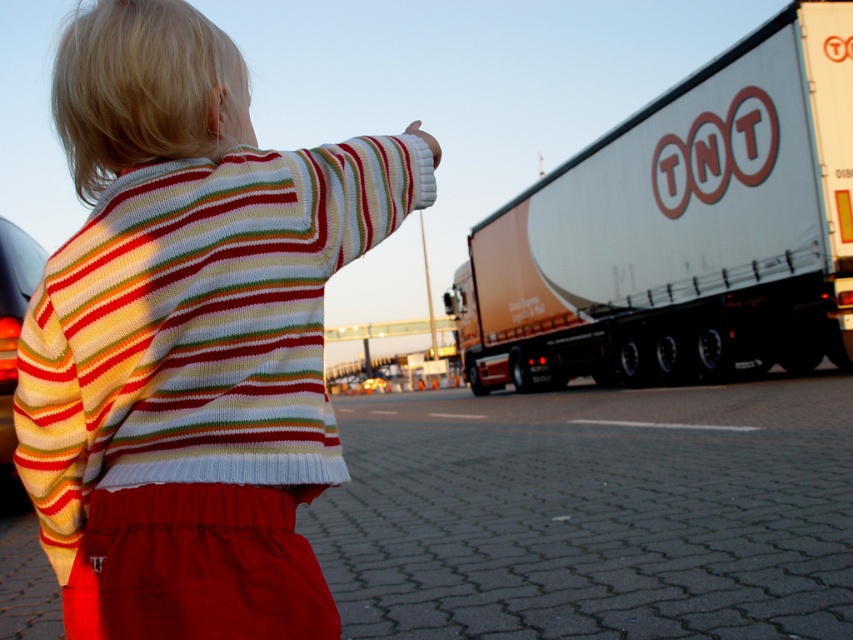
Question: Among these points, which one is farthest from the camera?

Choices:
 (A) (663, 216)
 (B) (283, 416)

Answer: (A)

Question: From the image, what is the correct spatial relationship of knitted sweater at upper left in relation to white glossy trailer at right?

Choices:
 (A) left
 (B) right

Answer: (A)

Question: Can you confirm if knitted sweater at upper left is positioned to the left of white glossy trailer at right?

Choices:
 (A) yes
 (B) no

Answer: (A)

Question: Is knitted sweater at upper left below white glossy trailer at right?

Choices:
 (A) no
 (B) yes

Answer: (B)